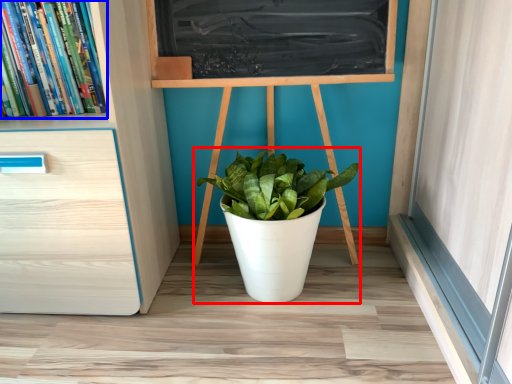
Question: Which point is further to the camera, houseplant (highlighted by a red box) or book (highlighted by a blue box)?

Choices:
 (A) houseplant
 (B) book

Answer: (A)